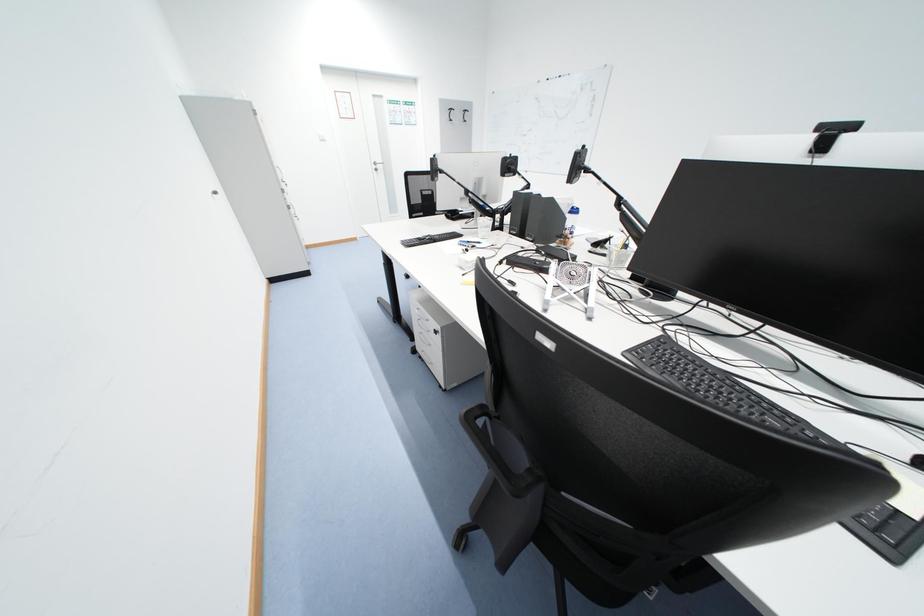
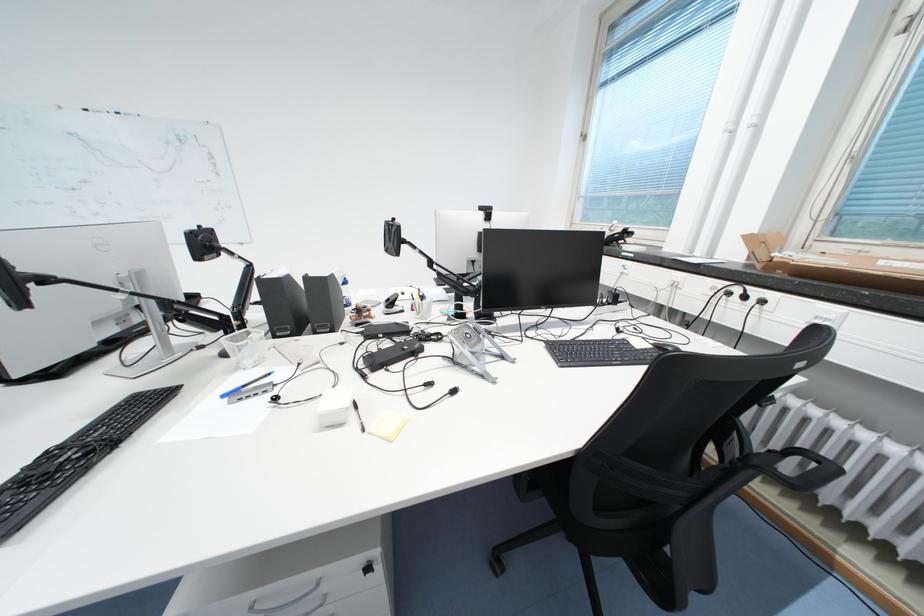
Question: The camera is either moving clockwise (left) or counter-clockwise (right) around the object. The first image is from the beginning of the video and the second image is from the end. Is the camera moving left or right when shooting the video?

Choices:
 (A) Left
 (B) Right

Answer: (A)